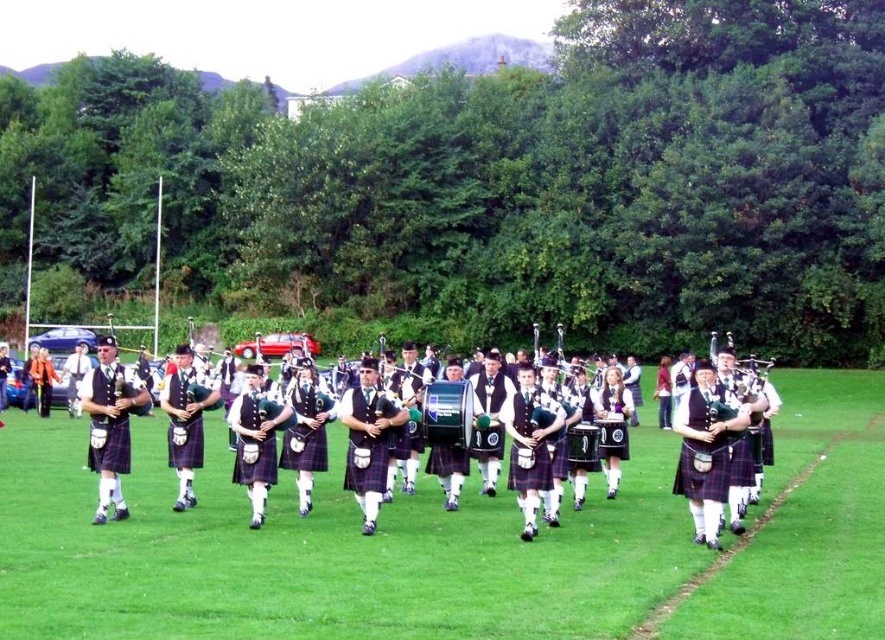
Is matte black kilt at center to the right of matte green bagpipe at center from the viewer's perspective?

No, matte black kilt at center is not to the right of matte green bagpipe at center.

Which is behind, point (99, 371) or point (522, 392)?

Point (99, 371)

I want to click on matte black kilt at center, so click(x=110, y=424).

The height and width of the screenshot is (640, 885). In order to click on matte black kilt at center in this screenshot , I will do `click(110, 424)`.

Is green grass at center wider than matte black kilt at center?

Yes, green grass at center is wider than matte black kilt at center.

Looking at this image, which of these two, green grass at center or matte black kilt at center, stands shorter?

green grass at center is shorter.

Find the location of a particular element. Image resolution: width=885 pixels, height=640 pixels. green grass at center is located at coordinates (325, 554).

Between green grass at center and matte green bagpipe at center, which one has more height?

With more height is matte green bagpipe at center.

Between point (553, 602) and point (527, 394), which one is positioned behind?

The point (527, 394) is behind.

Identify the location of green grass at center. This screenshot has height=640, width=885. (325, 554).